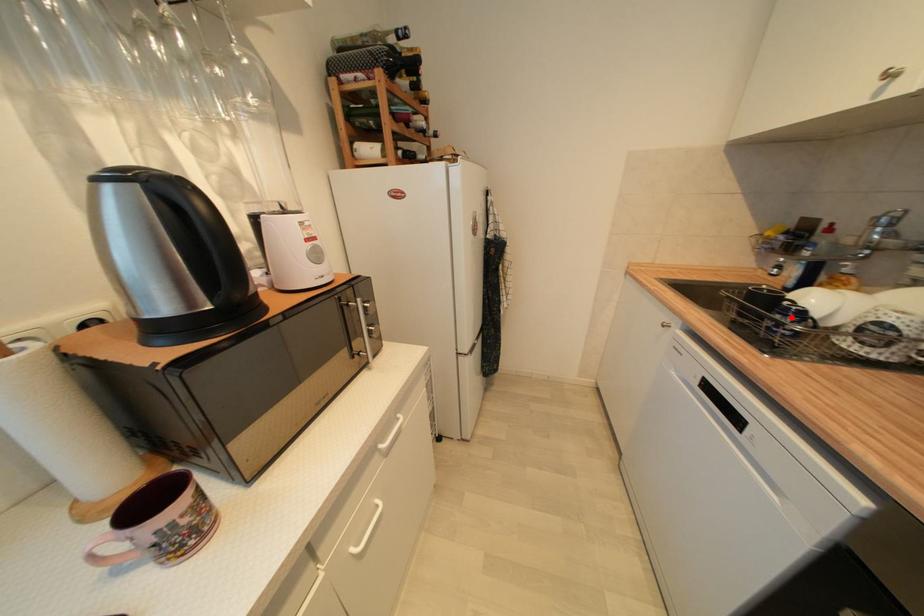
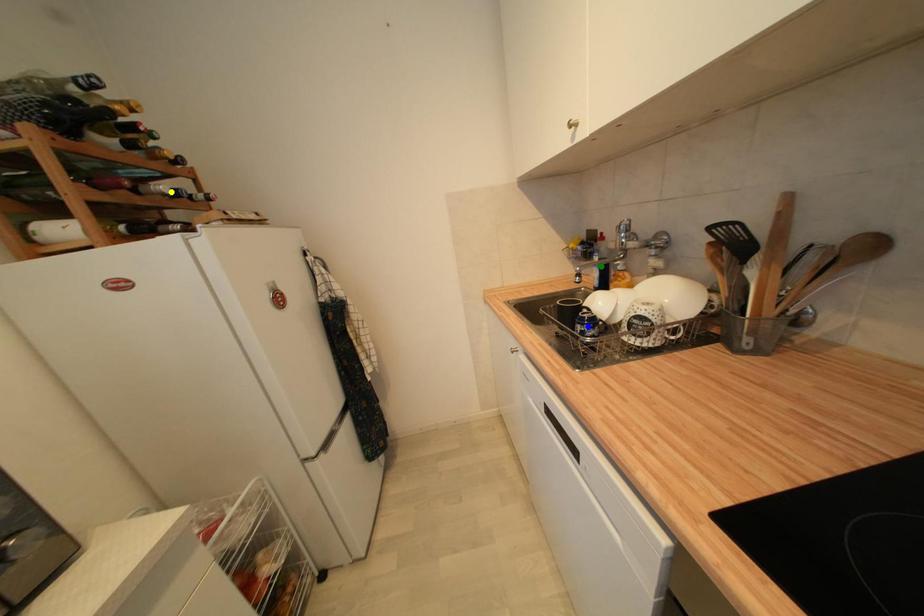
Question: I am providing you with two images of the same scene from different viewpoints. A red point is marked on the first image. You are given multiple points on the second image. In image 2, which mark is for the same physical point as the one in image 1?

Choices:
 (A) green point
 (B) yellow point
 (C) blue point

Answer: (C)